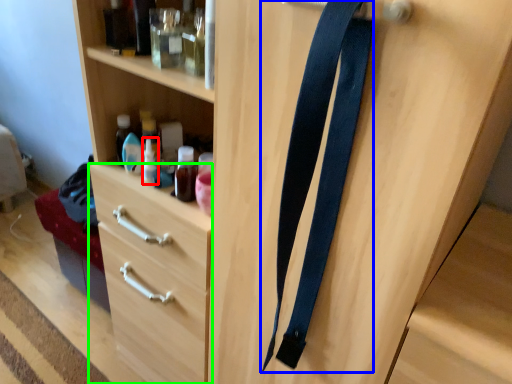
Question: Which object is the farthest from bottle (highlighted by a red box)? Choose among these: suspenders (highlighted by a blue box) or drawer (highlighted by a green box).

Choices:
 (A) suspenders
 (B) drawer

Answer: (A)